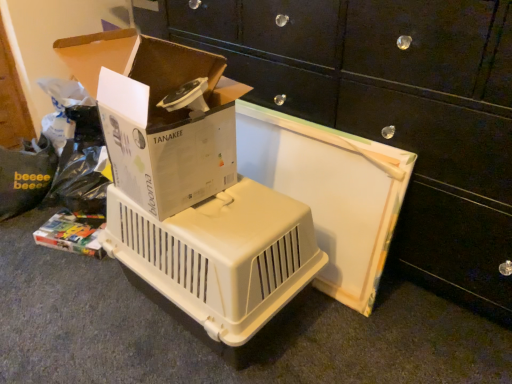
Question: Is white cardboard box at upper left taller or shorter than beige plastic pet carrier at center?

Choices:
 (A) short
 (B) tall

Answer: (A)

Question: Is white cardboard box at upper left to the left or to the right of beige plastic pet carrier at center in the image?

Choices:
 (A) right
 (B) left

Answer: (B)

Question: Which object is the farthest from the white plastic pet carrier at center?

Choices:
 (A) white cardboard box at upper left
 (B) beige plastic pet carrier at center

Answer: (B)

Question: Based on their relative distances, which object is farther from the beige plastic pet carrier at center?

Choices:
 (A) white cardboard box at upper left
 (B) white plastic pet carrier at center

Answer: (B)